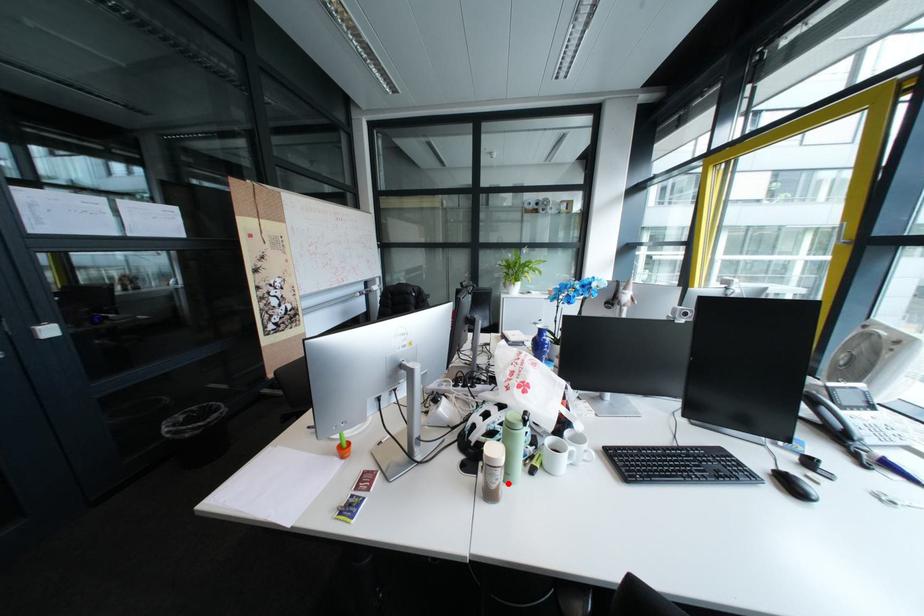
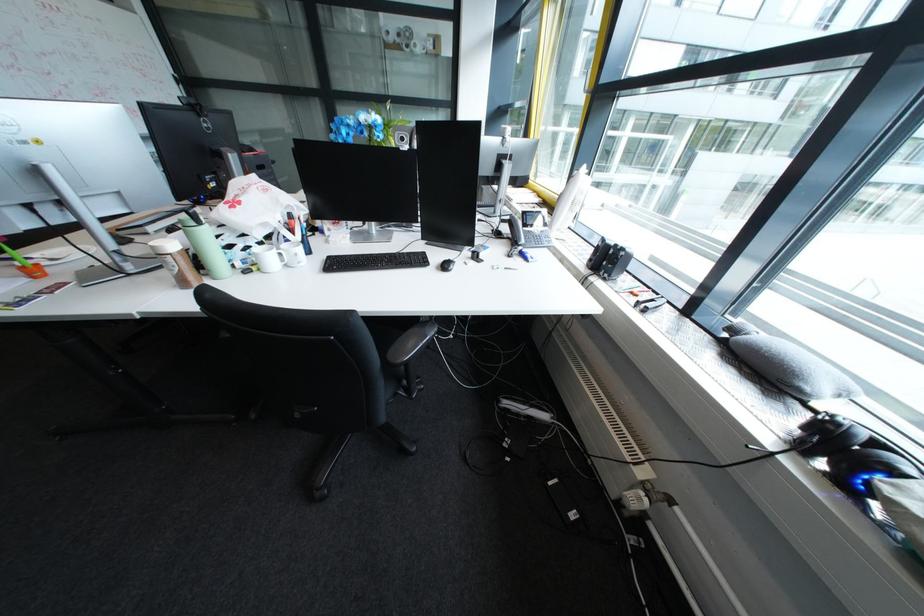
Question: I am providing you with two images of the same scene from different viewpoints. Given a red point in image1, look at the same physical point in image2. Is it:

Choices:
 (A) Closer to the viewpoint
 (B) Farther from the viewpoint

Answer: (A)